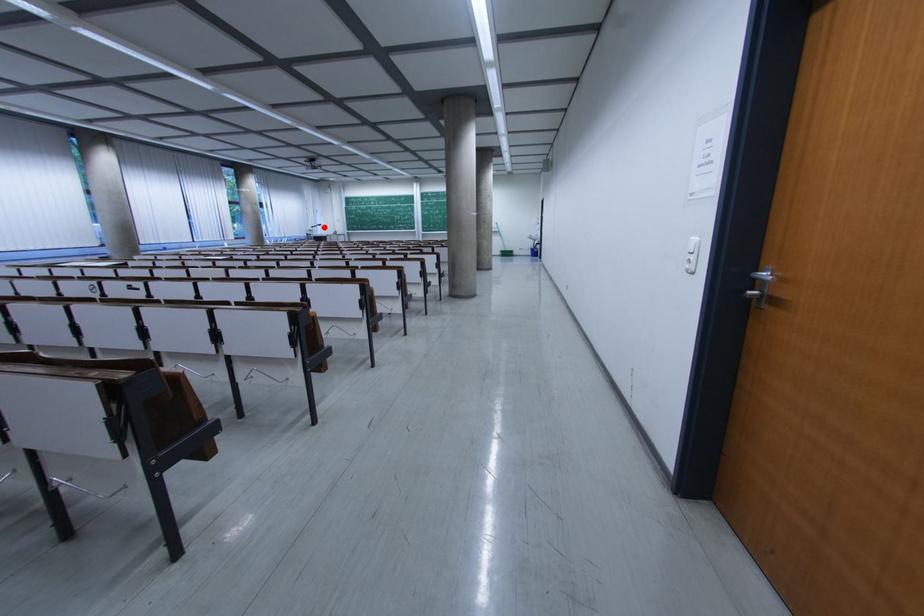
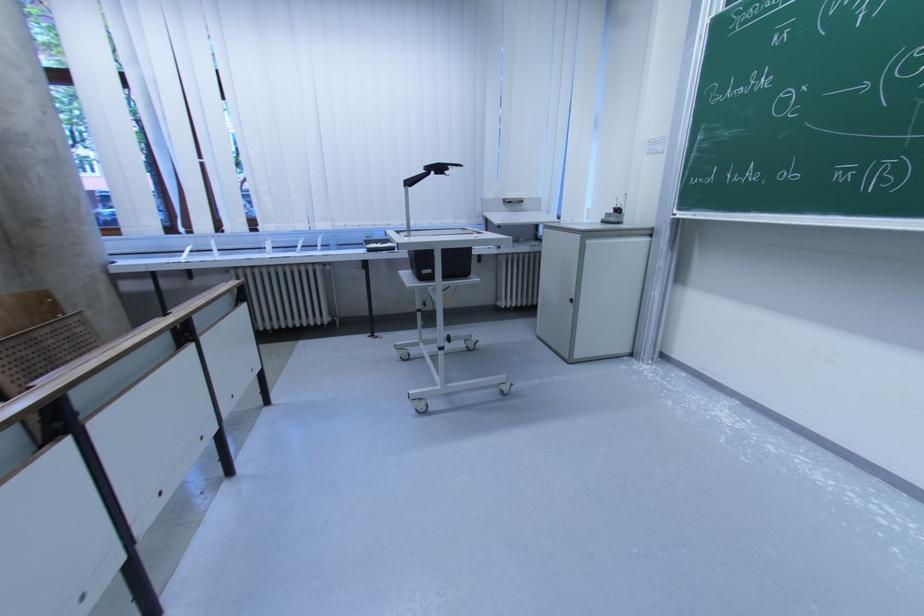
Question: I am providing you with two images of the same scene from different viewpoints. A red point is shown in image1. For the corresponding object point in image2, is it positioned nearer or farther from the camera?

Choices:
 (A) Nearer
 (B) Farther

Answer: (B)